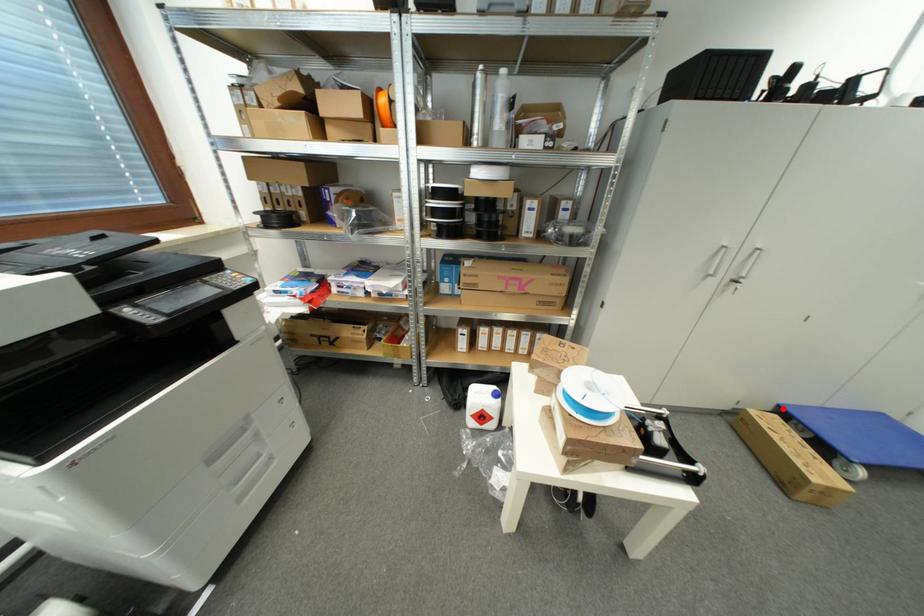
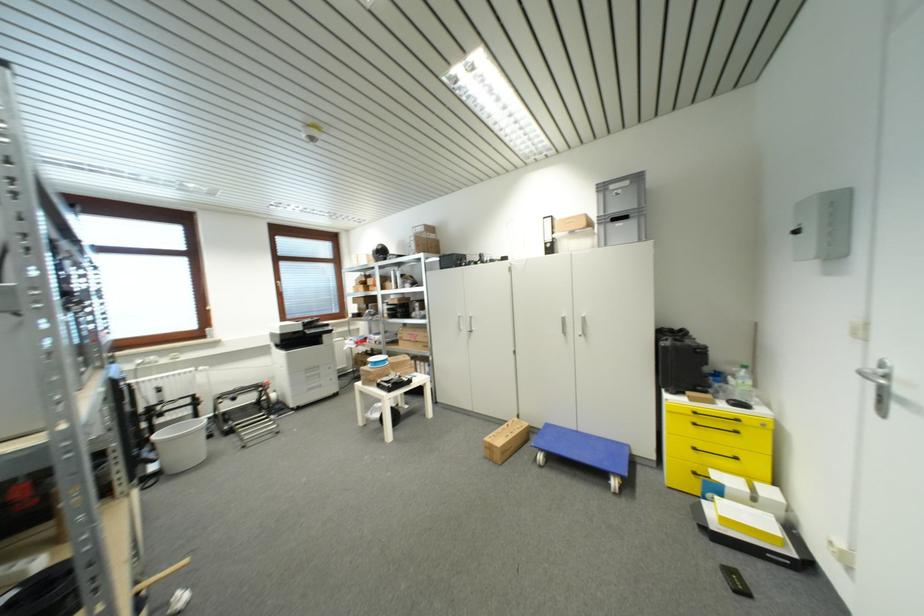
The point at the highlighted location is marked in the first image. Where is the corresponding point in the second image?

(552, 427)